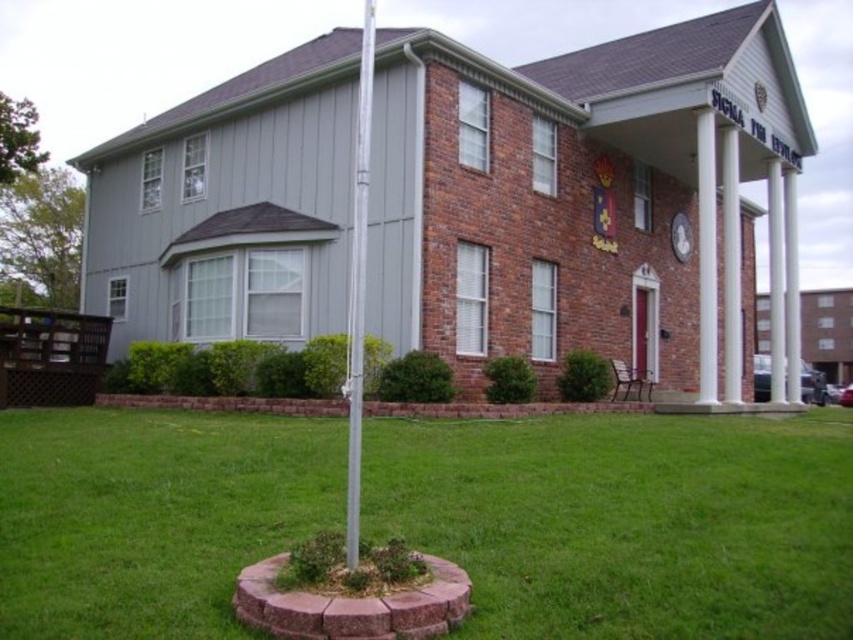
Question: Estimate the real-world distances between objects in this image. Which object is farther from the white smooth pillar at right?

Choices:
 (A) white glossy pillar at center
 (B) silver metallic pole at center

Answer: (B)

Question: Which object appears closest to the camera in this image?

Choices:
 (A) white smooth column at center
 (B) white marble pillar at right

Answer: (B)

Question: Does silver metallic pole at center have a smaller size compared to white glossy pillar at center?

Choices:
 (A) no
 (B) yes

Answer: (A)

Question: Can you confirm if white marble pillar at right is positioned to the right of white smooth pillar at right?

Choices:
 (A) no
 (B) yes

Answer: (A)

Question: Does green grass at center lie behind silver metallic pole at center?

Choices:
 (A) no
 (B) yes

Answer: (A)

Question: Which is nearer to the white marble pillar at right?

Choices:
 (A) green grass at center
 (B) white glossy pillar at center

Answer: (B)